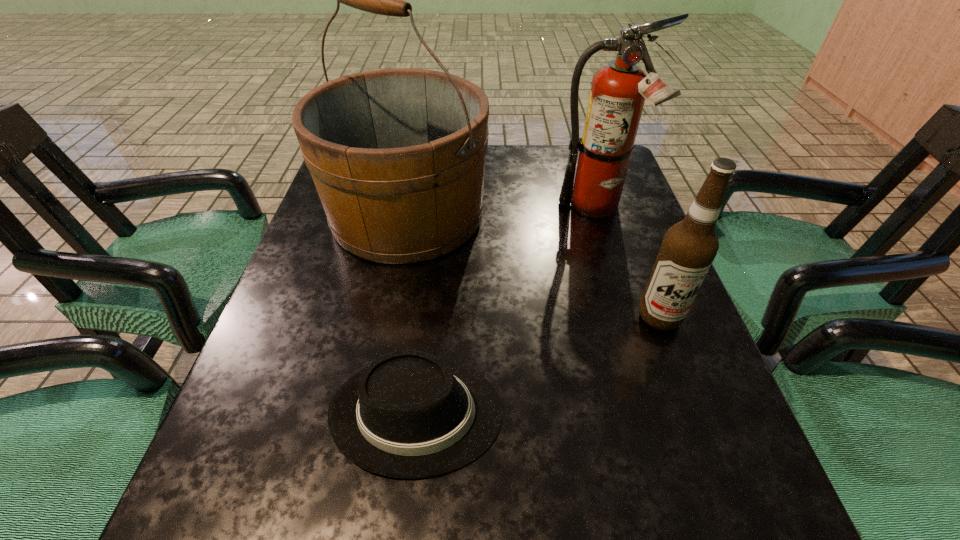
Where is `vacant space in between the third tallest object and the fire extinguisher`? vacant space in between the third tallest object and the fire extinguisher is located at coordinates (627, 262).

At what (x,y) coordinates should I click in order to perform the action: click on unoccupied position between the fire extinguisher and the third farthest object. Please return your answer as a coordinate pair (x, y). The height and width of the screenshot is (540, 960). Looking at the image, I should click on (627, 262).

Locate an element on the screen. empty space that is in between the fire extinguisher and the fedora is located at coordinates (507, 310).

This screenshot has height=540, width=960. Identify the location of object that stands as the third closest to the fire extinguisher. (408, 415).

The height and width of the screenshot is (540, 960). In order to click on the third closest object to the third tallest object in this screenshot , I will do `click(397, 156)`.

I want to click on free spot that satisfies the following two spatial constraints: 1. from the nozzle of the fire extinguisher; 2. on the front-facing side of the nearest object, so click(x=659, y=413).